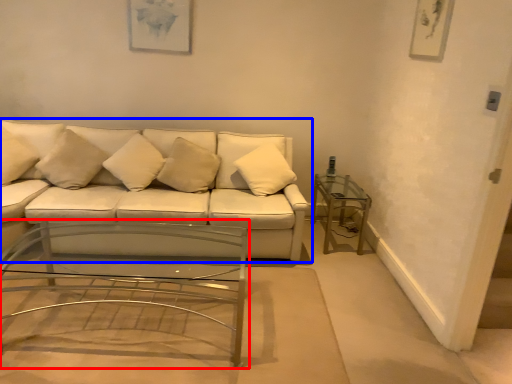
Question: Among these objects, which one is nearest to the camera, coffee table (highlighted by a red box) or studio couch (highlighted by a blue box)?

Choices:
 (A) coffee table
 (B) studio couch

Answer: (A)